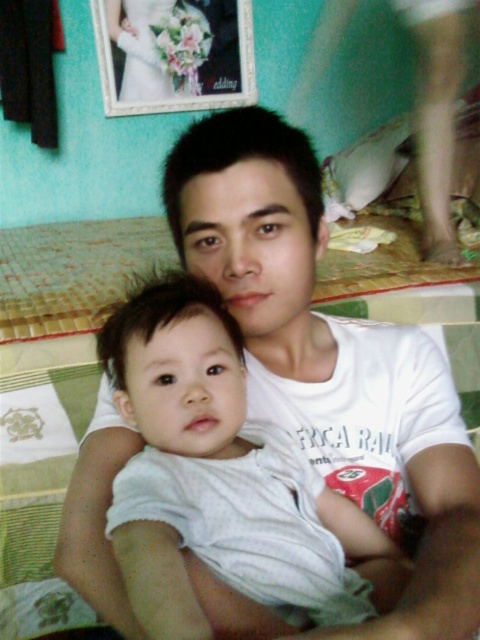
You are a photographer trying to capture a closeup of the white cotton baby at center in the image. The camera you are using has a limited field of view. Based on the coordinates provided, which object from the scene is located closest to the point at (220, 477)?

The point at (220, 477) corresponds to the white cotton baby at center, so the closest object is the white cotton baby at center.

You are a delivery robot that is 1 meter wide. You are in a room and need to deliver a package to the smooth skin leg at lower right. There is a white cotton baby at center in the way. Can you navigate around the baby to reach the leg?

The white cotton baby at center and smooth skin leg at lower right are 1.16 meters apart. Since the robot is 1 meter wide, there is enough space between them to navigate around the baby and reach the leg.